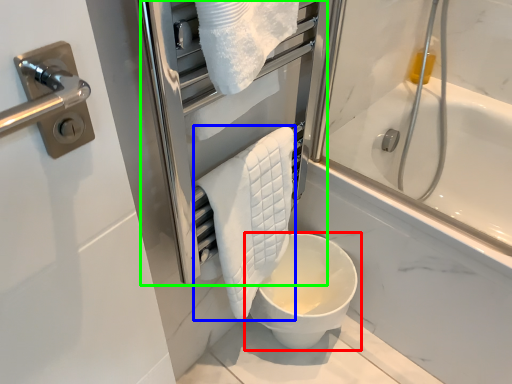
Question: Based on their relative distances, which object is farther from toilet (highlighted by a red box)? Choose from bath towel (highlighted by a blue box) and screen door (highlighted by a green box).

Choices:
 (A) bath towel
 (B) screen door

Answer: (B)